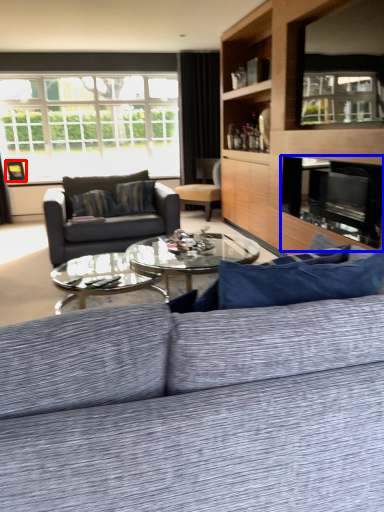
Question: Among these objects, which one is farthest to the camera, picture frame (highlighted by a red box) or fireplace (highlighted by a blue box)?

Choices:
 (A) picture frame
 (B) fireplace

Answer: (A)